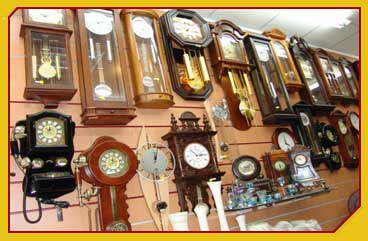
Find the location of a particular element. This screenshot has height=241, width=368. telephone is located at coordinates (15, 146).